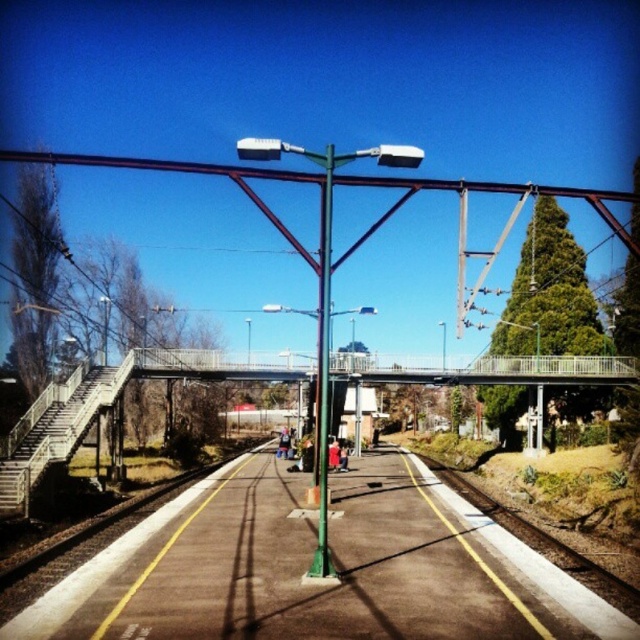
You are a passenger waiting for your train at the station. You see the metallic gray bridge at center and the silver metallic train at center. Which one is located higher from the ground?

The metallic gray bridge at center is above the silver metallic train at center, so the metallic gray bridge at center is higher from the ground.

You are standing at the point closer to the green streetlamp on the platform. There are two points marked on the platform, one at point (499,368) and the other at point (323,400). Which point is farther away from you?

Point (499,368) is behind point (323,400), so if you are standing closer to the green streetlamp, point (499,368) would be farther away from you.

You are a maintenance worker needing to reach the silver metallic train at center from the green metallic pole at center. The safety regulations state that you must stay within 40 meters of the pole at all times. Can you safely walk to the train without violating the regulation?

The distance between the green metallic pole at center and the silver metallic train at center is 39.80 meters, which is within the 40 meters safety regulation. Therefore, you can safely walk to the train without violating the regulation.